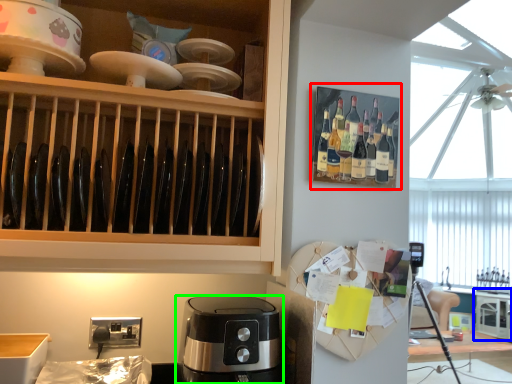
Question: Which object is the farthest from shelf (highlighted by a red box)? Choose among these: cabinetry (highlighted by a blue box) or coffee maker (highlighted by a green box).

Choices:
 (A) cabinetry
 (B) coffee maker

Answer: (A)